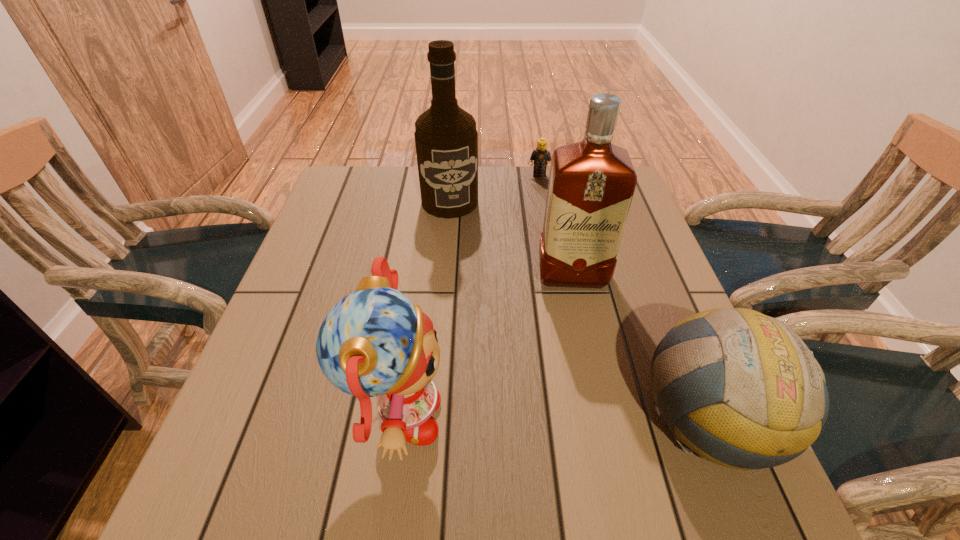
Locate an element on the screen. The width and height of the screenshot is (960, 540). volleyball situated at the near edge is located at coordinates (751, 395).

Image resolution: width=960 pixels, height=540 pixels. Find the location of `volleyball that is at the right edge`. volleyball that is at the right edge is located at coordinates (751, 395).

Locate an element on the screen. liquor located in the right edge section of the desktop is located at coordinates (591, 184).

Find the location of a particular element. Image resolution: width=960 pixels, height=540 pixels. object that is at the near right corner is located at coordinates (751, 395).

Where is `free location at the far edge of the desktop`? This screenshot has height=540, width=960. free location at the far edge of the desktop is located at coordinates (500, 188).

Where is `vacant space at the near edge of the desktop`? The width and height of the screenshot is (960, 540). vacant space at the near edge of the desktop is located at coordinates (531, 441).

Identify the location of vacant space at the left edge of the desktop. This screenshot has width=960, height=540. click(x=324, y=268).

Locate an element on the screen. vacant region at the right edge of the desktop is located at coordinates (639, 273).

The image size is (960, 540). In order to click on free space between the alcohol and the second shortest object in this screenshot , I will do `click(582, 310)`.

This screenshot has width=960, height=540. In order to click on vacant area that lies between the alcohol and the third tallest object in this screenshot , I will do `click(424, 312)`.